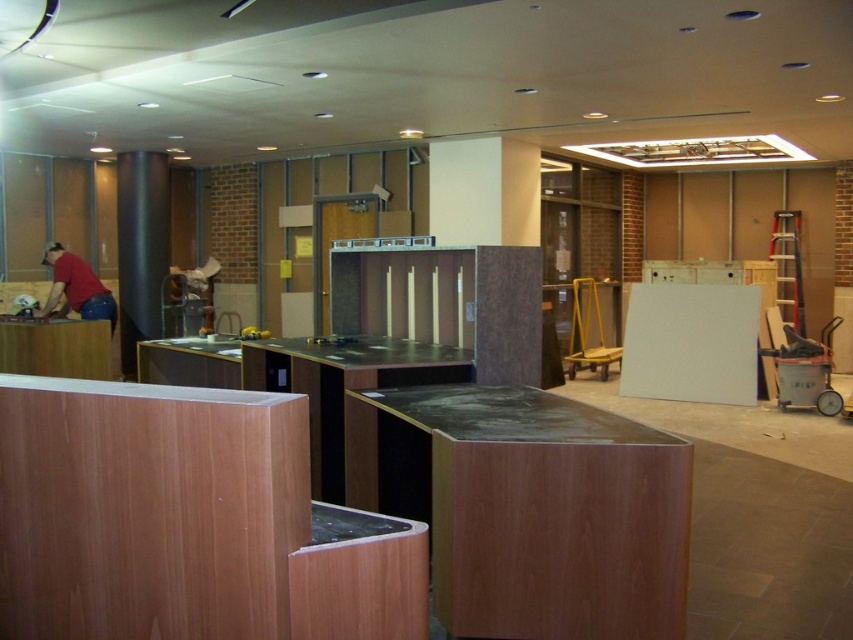
You are standing in the construction area and see the metallic gray column at left and the matte red shirt at left. Which object is closer to you?

The metallic gray column at left is closer to you because the matte red shirt at left is behind it.

Looking at this image, you are a delivery person who needs to place a package between the metallic gray column at left and the matte red shirt at left. The package is 5 feet long. Can you fit it between them?

The metallic gray column at left and matte red shirt at left are 6.03 feet apart from each other. Since the package is 5 feet long, it can fit between them as there is enough space.

You are a construction worker standing in the middle of the room. You need to move the matte red shirt at left out of the way to access the tools behind it. Can you move around the metallic gray column at left to reach the shirt?

The metallic gray column at left is to the left of the matte red shirt at left, so the column is positioned between you and the shirt. This means you cannot directly move around the column to reach the shirt from the middle of the room. You would need to go around the column first to access the shirt.